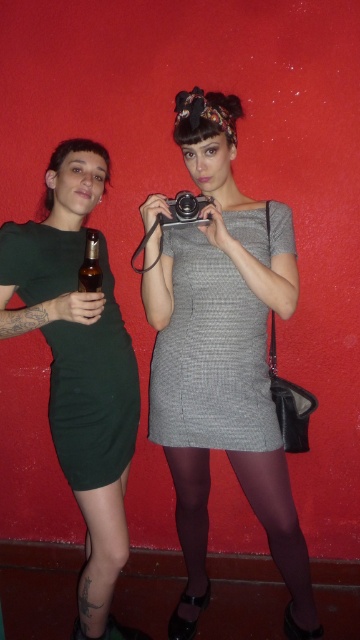
You are a photographer trying to position two subjects for a photo shoot. The scene includes a person wearing a dark green, short sleeved dress on the left and a matte gray dress at center. Based on their positions, which subject is closer to the camera?

The matte gray dress at center is located at point (222, 358), which is closer to the camera than the person on the left, so the matte gray dress at center is closer to the camera.

You are a photographer trying to decide whether to place the black metallic camera at center on a shelf next to the translucent amber glass bottle at left. The shelf can only hold items up to the size of the bottle. Will the camera fit?

The black metallic camera at center is larger than the translucent amber glass bottle at left, so it will not fit on the shelf designated for items up to the bottle size.

You are trying to decide which dress to choose for an event. The gray textured dress at center and the dark green jersey dress at left are both options. Based on the image, which dress has a wider silhouette?

The gray textured dress at center is wider than the dark green jersey dress at left according to the description.